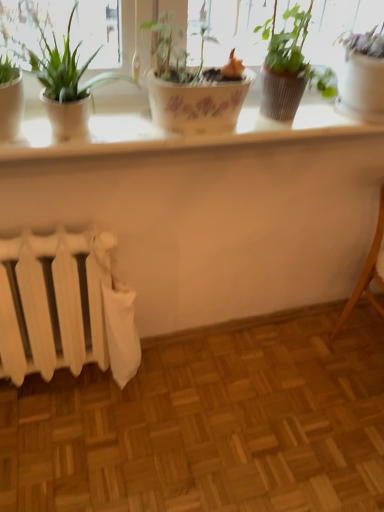
Where is `free area below white matte radiator at lower left (from a real-world perspective)`? free area below white matte radiator at lower left (from a real-world perspective) is located at coordinates (64, 382).